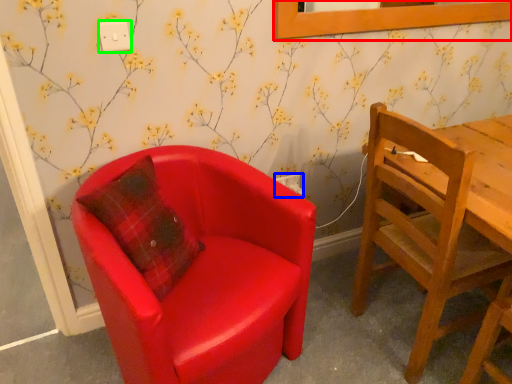
Question: Which is farther away from picture frame (highlighted by a red box)? power outlet (highlighted by a blue box) or power outlet (highlighted by a green box)?

Choices:
 (A) power outlet
 (B) power outlet

Answer: (B)